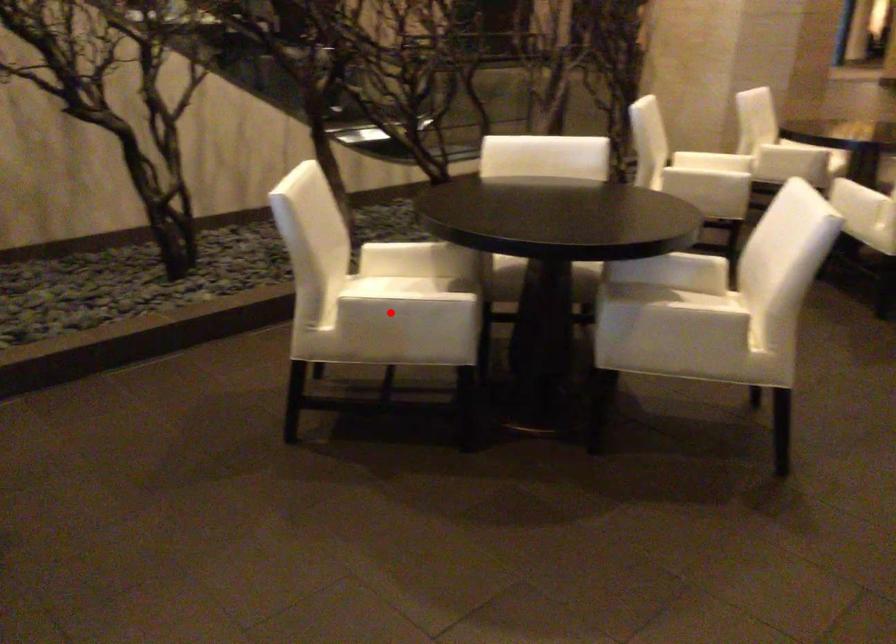
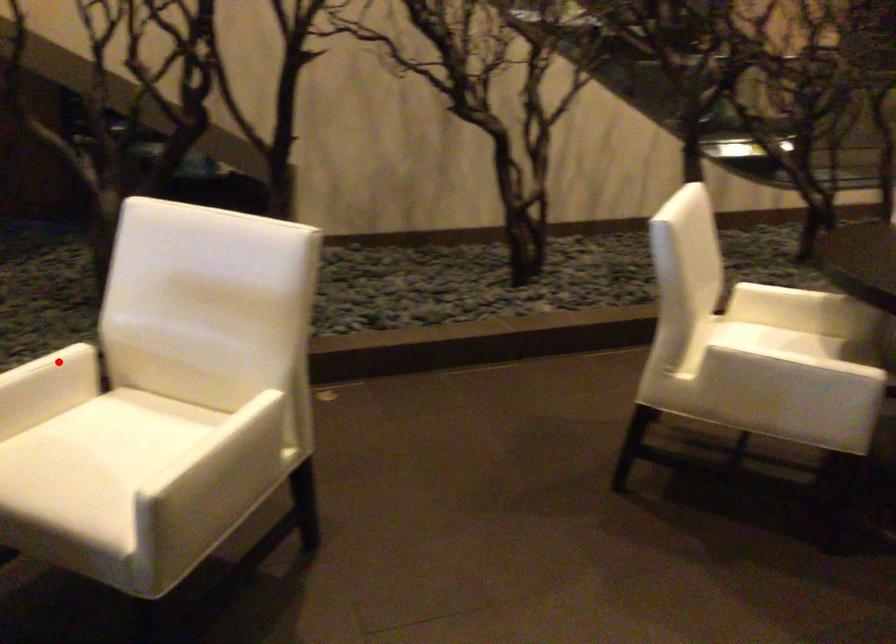
I am providing you with two images of the same scene from different viewpoints. A red point is marked on the first image and another point is marked on the second image. Do the highlighted points in image1 and image2 indicate the same real-world spot?

No